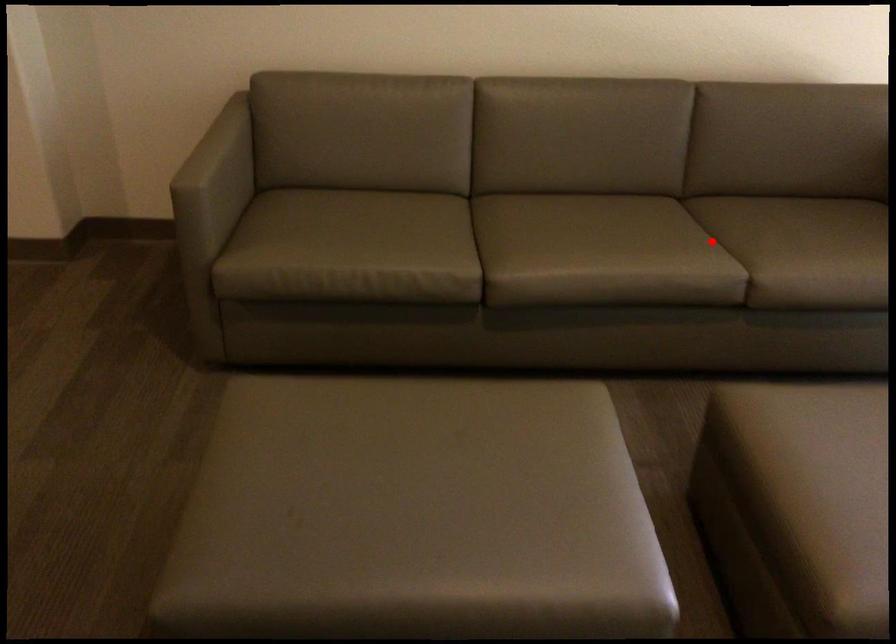
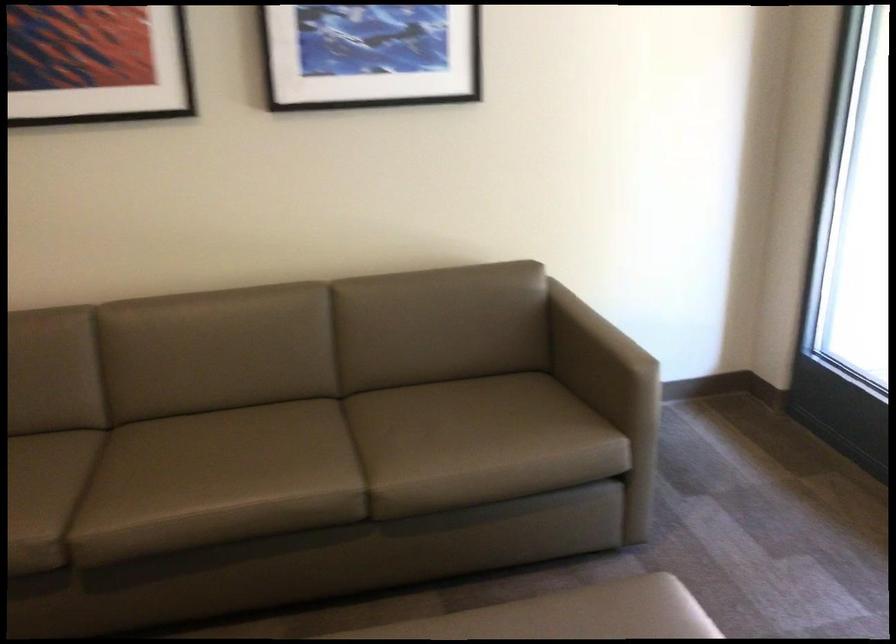
In the second image, find the point that corresponds to the highlighted location in the first image.

(356, 450)